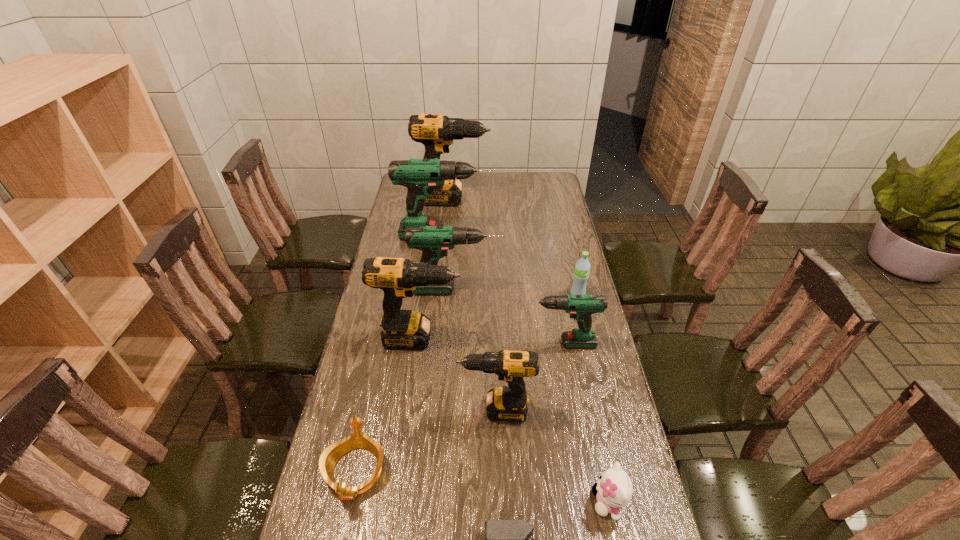
You are a GUI agent. You are given a task and a screenshot of the screen. Output one action in this format:
    pyautogui.click(x=<x>, y=<y>)
    Task: Click on the tiara that is at the left edge
    The image size is (960, 540).
    Given the screenshot: What is the action you would take?
    pyautogui.click(x=330, y=456)

In order to click on drill that is at the right edge in this screenshot , I will do `click(581, 307)`.

The height and width of the screenshot is (540, 960). Identify the location of water bottle that is at the right edge. (582, 267).

The width and height of the screenshot is (960, 540). In order to click on kitten situated at the right edge in this screenshot , I will do `click(614, 489)`.

Identify the location of object located in the far left corner section of the desktop. This screenshot has height=540, width=960. (436, 132).

The image size is (960, 540). Find the location of `vacant space at the far edge of the desktop`. vacant space at the far edge of the desktop is located at coordinates (504, 173).

Where is `vacant space at the left edge of the desktop`? This screenshot has width=960, height=540. vacant space at the left edge of the desktop is located at coordinates (321, 499).

Identify the location of vacant space at the right edge of the desktop. The width and height of the screenshot is (960, 540). (632, 471).

At what (x,y) coordinates should I click in order to perform the action: click on free space between the water bottle and the rightmost green drill. Please return your answer as a coordinate pair (x, y). Looking at the image, I should click on (568, 319).

You are a GUI agent. You are given a task and a screenshot of the screen. Output one action in this format:
    pyautogui.click(x=<x>, y=<y>)
    Task: Click on the free spot between the white kitten and the farthest black drill
    This screenshot has width=960, height=540.
    Given the screenshot: What is the action you would take?
    pyautogui.click(x=531, y=350)